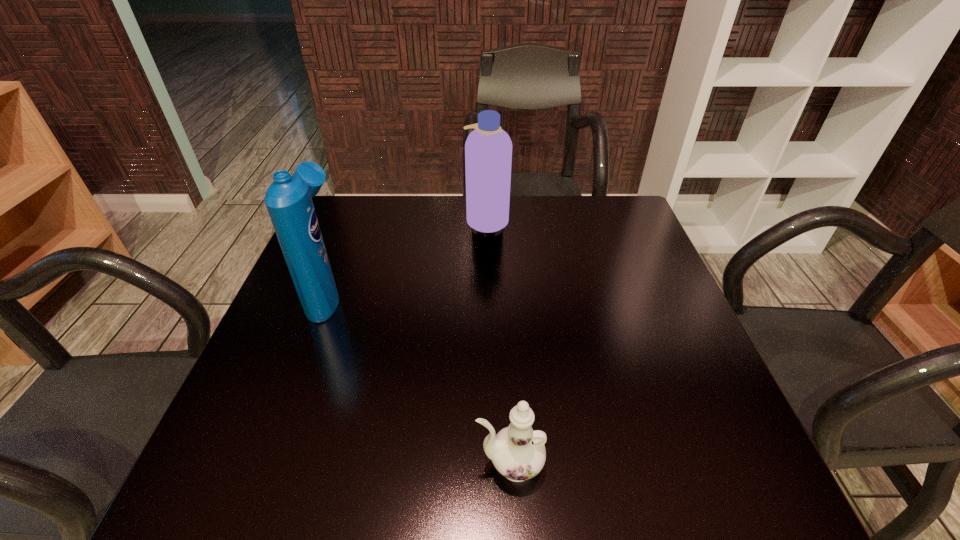
I want to click on the left shampoo, so (288, 199).

This screenshot has height=540, width=960. I want to click on the second farthest object, so click(x=288, y=199).

Identify the location of the farthest object. (488, 149).

The height and width of the screenshot is (540, 960). Identify the location of the right shampoo. (488, 149).

Where is `the nearest object`? The image size is (960, 540). the nearest object is located at coordinates (518, 452).

You are a GUI agent. You are given a task and a screenshot of the screen. Output one action in this format:
    pyautogui.click(x=<x>, y=<y>)
    Task: Click on the chinaware
    The image size is (960, 540).
    Given the screenshot: What is the action you would take?
    pyautogui.click(x=518, y=452)

Image resolution: width=960 pixels, height=540 pixels. What are the coordinates of `free space located 0.310m on the right of the second nearest object` in the screenshot? It's located at (477, 294).

The image size is (960, 540). Find the location of `blank area located 0.240m on the front of the right shampoo`. blank area located 0.240m on the front of the right shampoo is located at coordinates (489, 295).

Identify the location of vacant area located 0.200m at the spout of the nearest object. (353, 465).

Identify the location of free space located 0.180m at the spout of the nearest object. This screenshot has height=540, width=960. (366, 465).